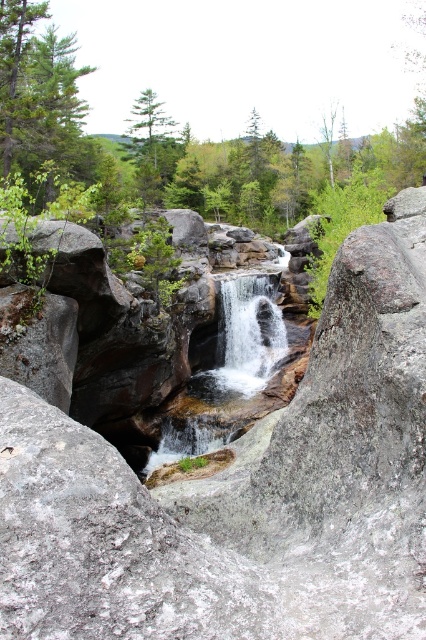
Can you confirm if green matte tree at upper left is positioned below white frothy water at center?

No, green matte tree at upper left is not below white frothy water at center.

Who is more forward, (49, 138) or (271, 365)?

Positioned in front is point (271, 365).

The height and width of the screenshot is (640, 426). Identify the location of green matte tree at upper left. (37, 92).

Does point (78, 448) lie in front of point (247, 340)?

Yes, it is.

Is gray rough rock at center shorter than white frothy water at center?

Indeed, gray rough rock at center has a lesser height compared to white frothy water at center.

Does point (408, 292) come closer to viewer compared to point (287, 349)?

Yes.

Identify the location of gray rough rock at center. The width and height of the screenshot is (426, 640). (244, 492).

Does smooth rock waterfall at center appear on the right side of green matte tree at upper center?

Indeed, smooth rock waterfall at center is positioned on the right side of green matte tree at upper center.

Which is more to the right, smooth rock waterfall at center or green matte tree at upper center?

From the viewer's perspective, smooth rock waterfall at center appears more on the right side.

Does point (187, 442) come in front of point (132, 122)?

Yes, it is.

Find the location of a particular element. The height and width of the screenshot is (640, 426). smooth rock waterfall at center is located at coordinates (241, 342).